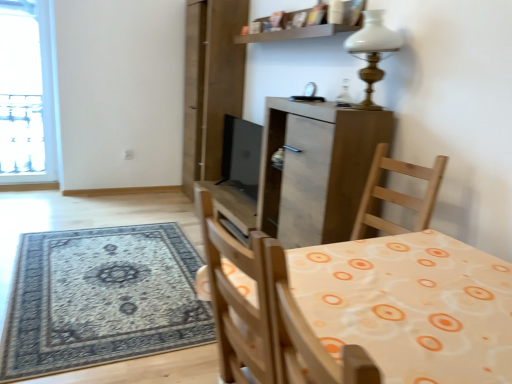
Question: From a real-world perspective, is matte wood cabinet at center positioned above or below white glass lamp at upper center?

Choices:
 (A) above
 (B) below

Answer: (B)

Question: Visually, is matte wood cabinet at center positioned to the left or to the right of white glass lamp at upper center?

Choices:
 (A) right
 (B) left

Answer: (B)

Question: Considering the real-world distances, which object is closest to the wooden table at center?

Choices:
 (A) white glass lamp at upper center
 (B) matte wood cabinet at center
 (C) wooden shelf at upper center
 (D) black matte screen door at upper center

Answer: (B)

Question: Which is nearer to the black matte screen door at upper center?

Choices:
 (A) wooden table at center
 (B) wooden shelf at upper center
 (C) matte wood cabinet at center
 (D) white glass lamp at upper center

Answer: (B)